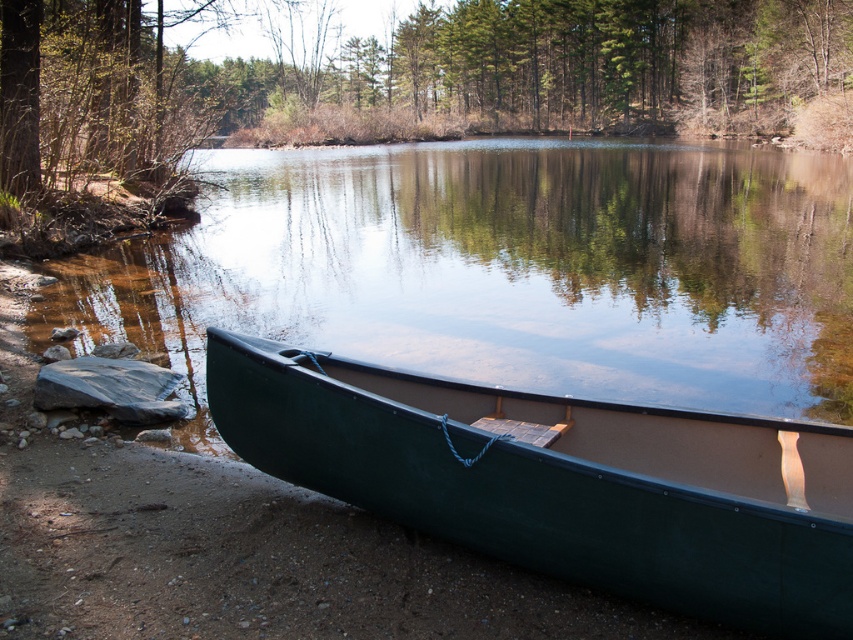
You are standing on the lakeside and want to know if the clear water at center is higher or lower than the green plastic canoe at lower center. Based on the scene, can you determine which one is higher?

The clear water at center is much taller than the green plastic canoe at lower center, so the clear water at center is higher.

You are standing at the point with coordinates point (833, 541) and want to reach the point with coordinates point (509, 337). Which direction should you move in to get there?

To move from point (833, 541) to point (509, 337), you should move forward since point (509, 337) is behind point (833, 541).